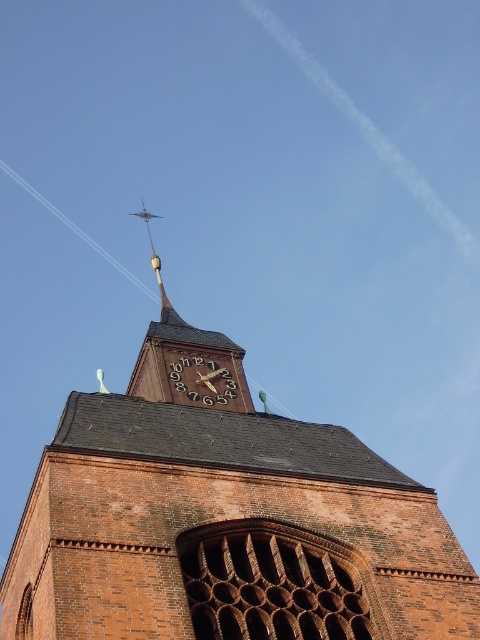
You are standing at the coordinates 0.5, 0.5 in the image. Which direction should you move to reach the brown brick church at center?

The brown brick church at center is located at point (x=225, y=522). Since you are at (x=240, y=320), you should move northeast to reach it.